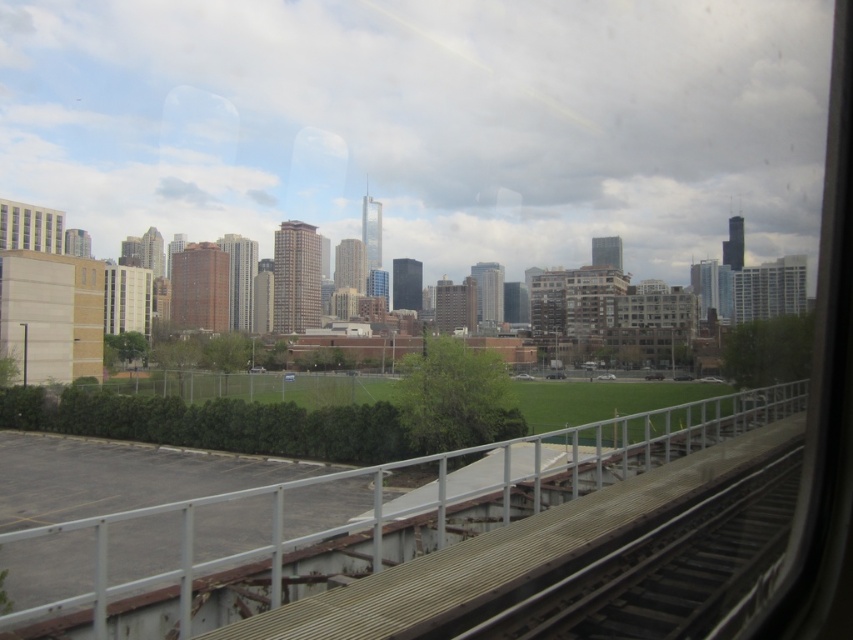
Is the position of metal/weathered rail at center more distant than that of matte glass building at left?

No, metal/weathered rail at center is in front of matte glass building at left.

Who is taller, metal/weathered rail at center or matte glass building at left?

Standing taller between the two is matte glass building at left.

Does point (247, 490) come closer to viewer compared to point (16, 225)?

Yes, it is in front of point (16, 225).

The image size is (853, 640). Identify the location of metal/weathered rail at center. (387, 518).

The width and height of the screenshot is (853, 640). What are the coordinates of `metal/weathered rail at center` in the screenshot? It's located at (387, 518).

Is metal/weathered rail at center bigger than smooth metal train track at lower right?

Yes, metal/weathered rail at center is bigger than smooth metal train track at lower right.

Is point (187, 502) closer to camera compared to point (602, 584)?

No, (187, 502) is behind (602, 584).

Find the location of a particular element. This screenshot has height=640, width=853. metal/weathered rail at center is located at coordinates (387, 518).

Is point (786, 516) positioned behind point (38, 227)?

No, it is not.

Does smooth metal train track at lower right appear over matte glass building at left?

No.

Image resolution: width=853 pixels, height=640 pixels. I want to click on smooth metal train track at lower right, so tap(666, 570).